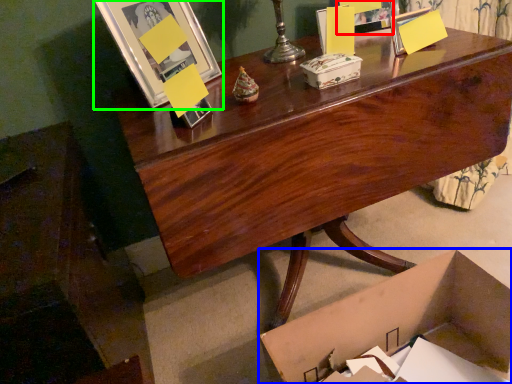
Question: Which object is the closest to the picture frame (highlighted by a red box)? Choose among these: box (highlighted by a blue box) or picture frame (highlighted by a green box).

Choices:
 (A) box
 (B) picture frame

Answer: (B)